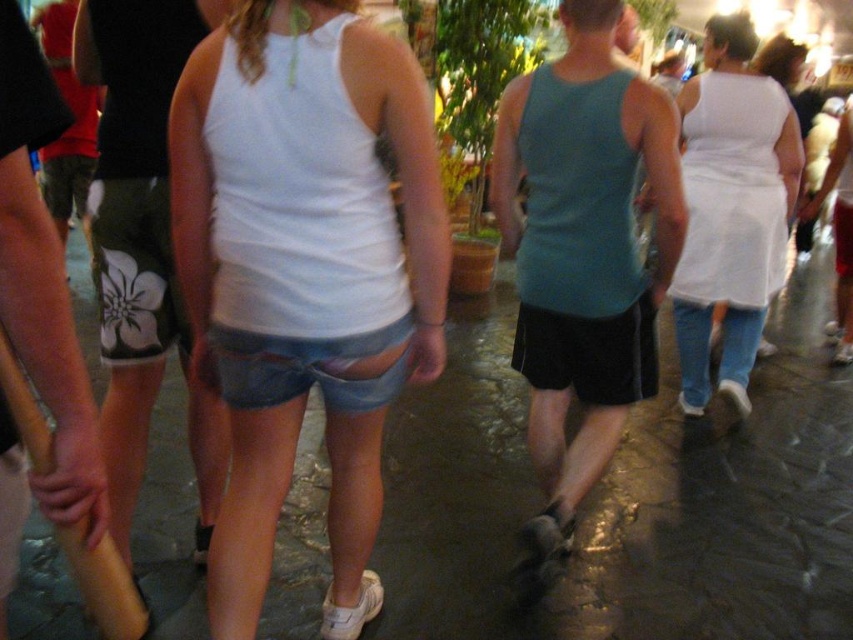
Question: Based on their relative distances, which object is nearer to the white matte tank top at center?

Choices:
 (A) teal fabric shorts at center
 (B) wet stone pavement at center

Answer: (A)

Question: Which object is closer to the camera taking this photo?

Choices:
 (A) white matte tank top at center
 (B) white cotton dress at upper right
 (C) teal fabric shorts at center

Answer: (A)

Question: Can you confirm if teal fabric shorts at center is wider than white cotton dress at upper right?

Choices:
 (A) no
 (B) yes

Answer: (A)

Question: Can you confirm if wet stone pavement at center is smaller than white cotton dress at upper right?

Choices:
 (A) no
 (B) yes

Answer: (A)

Question: Among these objects, which one is farthest from the camera?

Choices:
 (A) white matte tank top at center
 (B) wet stone pavement at center

Answer: (B)

Question: Is wet stone pavement at center to the left of teal fabric shorts at center from the viewer's perspective?

Choices:
 (A) no
 (B) yes

Answer: (A)